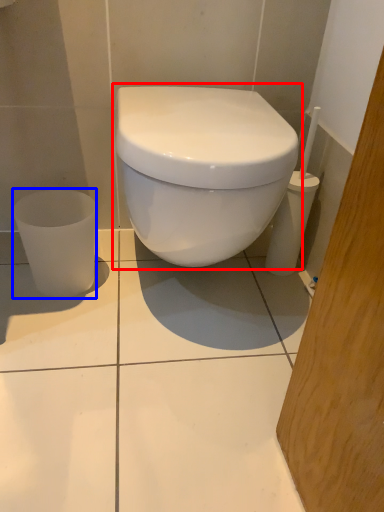
Question: Which object is further to the camera taking this photo, toilet (highlighted by a red box) or porcelain (highlighted by a blue box)?

Choices:
 (A) toilet
 (B) porcelain

Answer: (B)